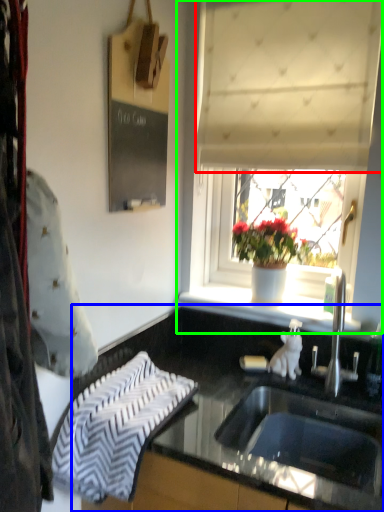
Question: Estimate the real-world distances between objects in this image. Which object is farther from curtain (highlighted by a red box), countertop (highlighted by a blue box) or window (highlighted by a green box)?

Choices:
 (A) countertop
 (B) window

Answer: (A)